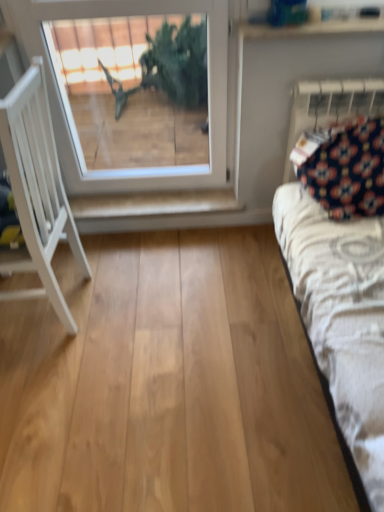
Question: Is dark blue fabric at upper right outside of white glass window at upper center?

Choices:
 (A) yes
 (B) no

Answer: (A)

Question: From a real-world perspective, does dark blue fabric at upper right stand above white glass window at upper center?

Choices:
 (A) no
 (B) yes

Answer: (A)

Question: From the image's perspective, would you say dark blue fabric at upper right is positioned over white glass window at upper center?

Choices:
 (A) yes
 (B) no

Answer: (B)

Question: Does dark blue fabric at upper right have a greater height compared to white glass window at upper center?

Choices:
 (A) yes
 (B) no

Answer: (B)

Question: Is dark blue fabric at upper right bigger than white glass window at upper center?

Choices:
 (A) yes
 (B) no

Answer: (B)

Question: From the image's perspective, is dark blue fabric at upper right under white glass window at upper center?

Choices:
 (A) yes
 (B) no

Answer: (A)

Question: Is white glass window at upper center at the back of white painted wood shelf at center?

Choices:
 (A) yes
 (B) no

Answer: (B)

Question: From the image's perspective, is white painted wood shelf at center located above white glass window at upper center?

Choices:
 (A) yes
 (B) no

Answer: (B)

Question: From a real-world perspective, is white painted wood shelf at center positioned over white glass window at upper center based on gravity?

Choices:
 (A) no
 (B) yes

Answer: (A)

Question: Does white painted wood shelf at center come behind white glass window at upper center?

Choices:
 (A) no
 (B) yes

Answer: (B)

Question: Considering the relative positions of white painted wood shelf at center and white glass window at upper center in the image provided, is white painted wood shelf at center to the left of white glass window at upper center from the viewer's perspective?

Choices:
 (A) yes
 (B) no

Answer: (B)

Question: Is the depth of white painted wood shelf at center less than that of white glass window at upper center?

Choices:
 (A) yes
 (B) no

Answer: (B)

Question: Does white painted wood shelf at center lie behind dark blue fabric at upper right?

Choices:
 (A) no
 (B) yes

Answer: (B)